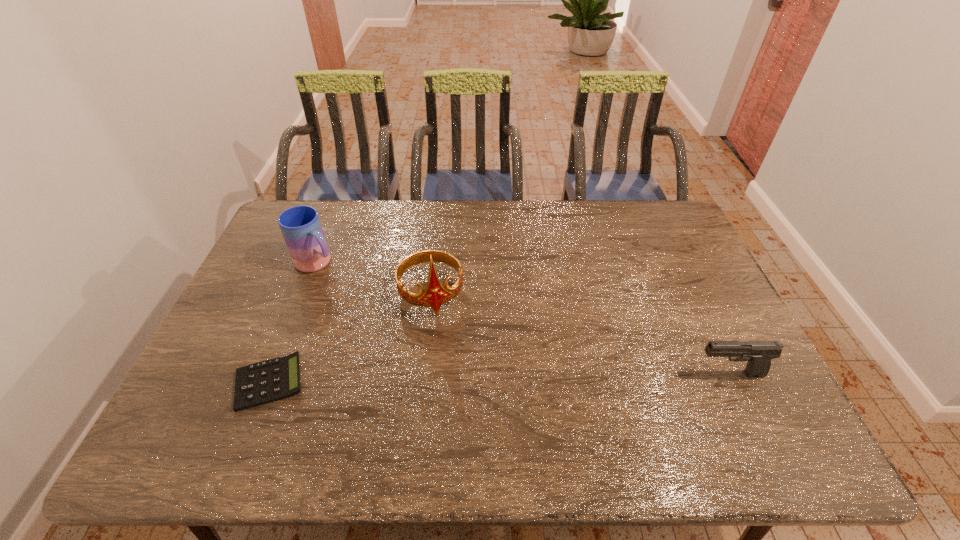
At what (x,y) coordinates should I click in order to perform the action: click on calculator. Please return your answer as a coordinate pair (x, y). Looking at the image, I should click on (272, 380).

You are a GUI agent. You are given a task and a screenshot of the screen. Output one action in this format:
    pyautogui.click(x=<x>, y=<y>)
    Task: Click on the third tallest object
    The image size is (960, 540).
    Given the screenshot: What is the action you would take?
    pyautogui.click(x=759, y=354)

This screenshot has height=540, width=960. Find the location of `the rightmost object`. the rightmost object is located at coordinates (759, 354).

Identify the location of tiara. The image size is (960, 540). (435, 294).

Locate an element on the screen. The height and width of the screenshot is (540, 960). the second object from right to left is located at coordinates (435, 294).

You are a GUI agent. You are given a task and a screenshot of the screen. Output one action in this format:
    pyautogui.click(x=<x>, y=<y>)
    Task: Click on the second tallest object
    
    Given the screenshot: What is the action you would take?
    tap(301, 228)

Identify the location of free space located 0.250m on the back of the calculator. Image resolution: width=960 pixels, height=540 pixels. (306, 288).

Image resolution: width=960 pixels, height=540 pixels. I want to click on free spot located aim along the barrel of the rightmost object, so click(564, 374).

This screenshot has width=960, height=540. Find the location of `vacant space located aim along the barrel of the rightmost object`. vacant space located aim along the barrel of the rightmost object is located at coordinates (675, 374).

This screenshot has height=540, width=960. In order to click on vacant region located 0.110m aim along the barrel of the rightmost object in this screenshot , I will do `click(651, 374)`.